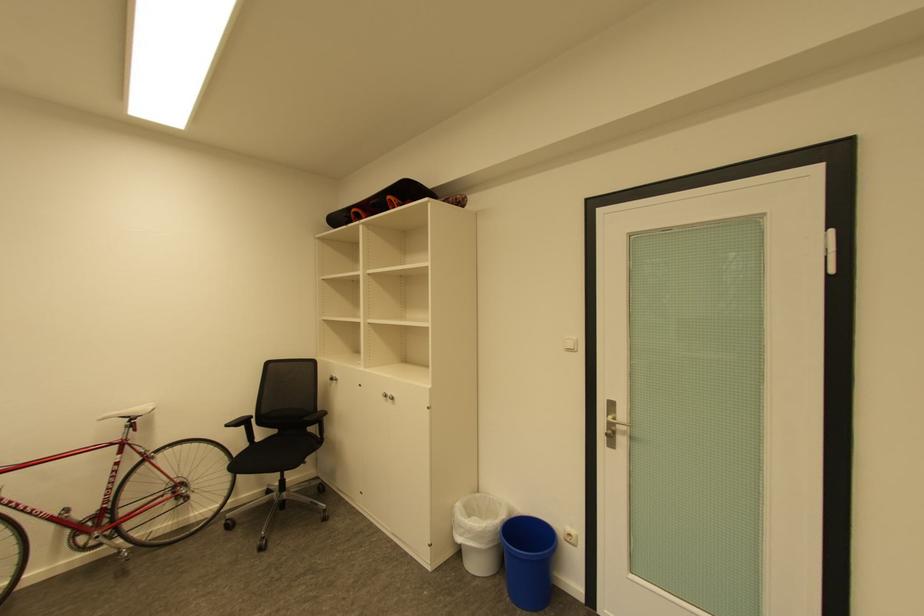
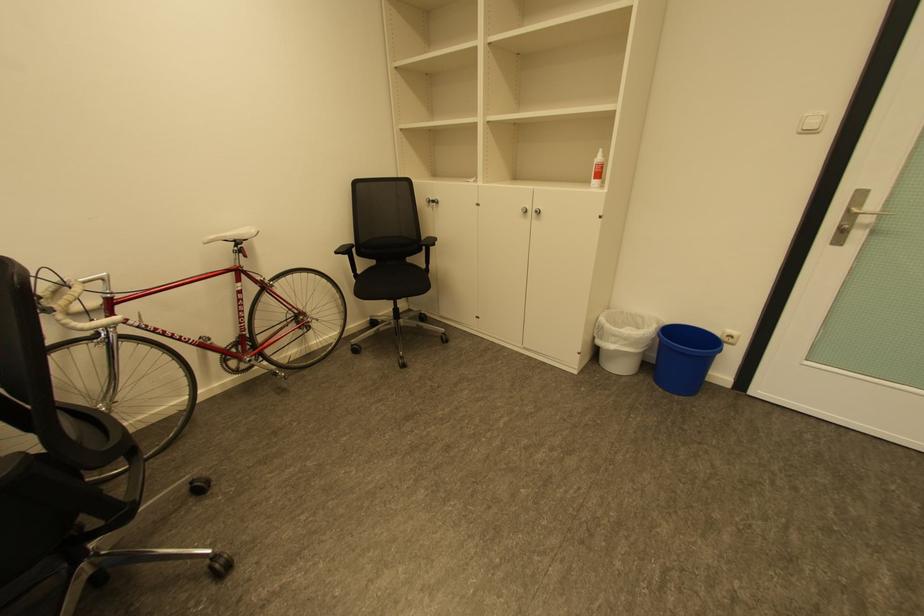
Find the pixel in the second image that matches the point at 468,528 in the first image.

(622, 337)